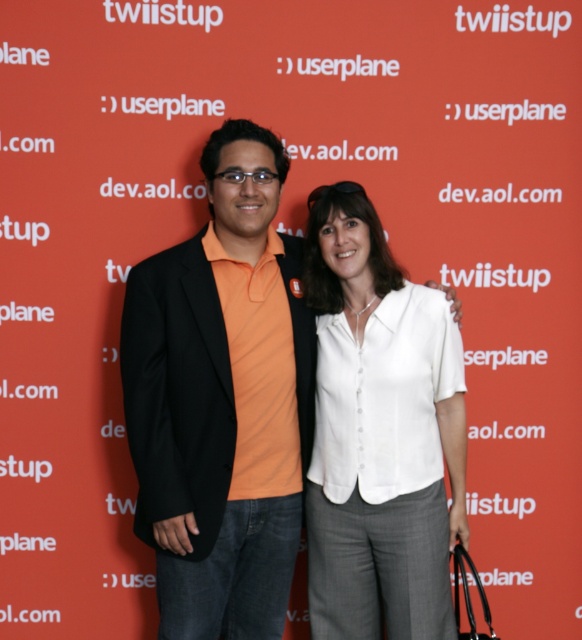
Question: Does orange cotton shirt at center have a larger size compared to white cotton blouse at center?

Choices:
 (A) yes
 (B) no

Answer: (A)

Question: Is orange cotton shirt at center to the right of white cotton blouse at center from the viewer's perspective?

Choices:
 (A) no
 (B) yes

Answer: (A)

Question: Which point is farther to the camera?

Choices:
 (A) orange cotton shirt at center
 (B) white cotton blouse at center

Answer: (B)

Question: Is the position of orange cotton shirt at center more distant than that of white cotton blouse at center?

Choices:
 (A) no
 (B) yes

Answer: (A)

Question: Which point is farther from the camera taking this photo?

Choices:
 (A) (450, 333)
 (B) (129, 404)

Answer: (A)